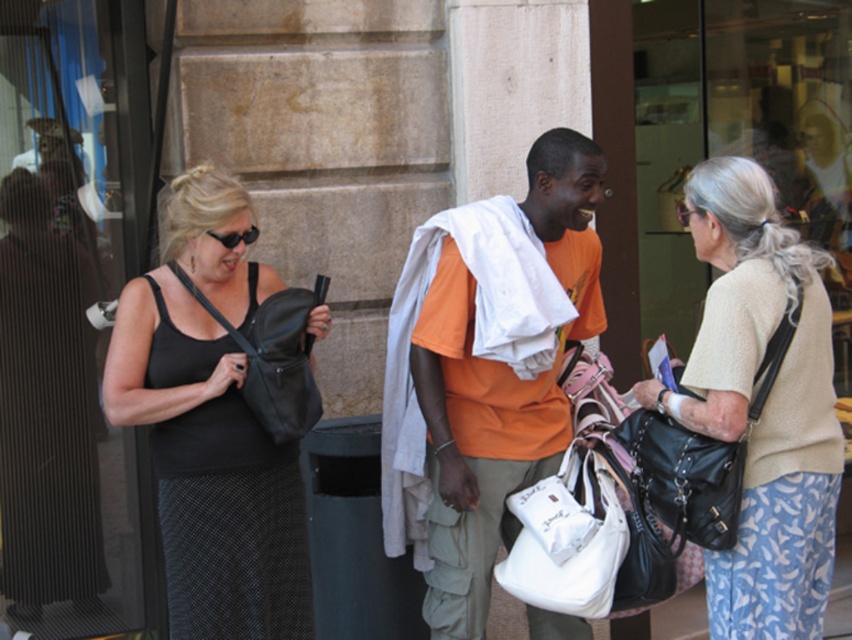
Which is above, black leather bag at center or black plastic sunglasses at upper left?

black plastic sunglasses at upper left is higher up.

Identify the location of black leather bag at center. (275, 356).

From the picture: Measure the distance between point (289,406) and camera.

Point (289,406) is 3.28 meters away from camera.

At what (x,y) coordinates should I click in order to perform the action: click on black leather bag at center. Please return your answer as a coordinate pair (x, y). The image size is (852, 640). Looking at the image, I should click on click(x=275, y=356).

Identify the location of black leather handbag at right. (701, 456).

Is black leather handbag at right positioned at the back of black leather bag at center?

No, it is in front of black leather bag at center.

Consider the image. Who is more distant from viewer, [694,504] or [281,419]?

The point [281,419] is behind.

Identify the location of black leather handbag at right. Image resolution: width=852 pixels, height=640 pixels. (701, 456).

Between orange cotton shirt at center and black leather handbag at right, which one has more height?

With more height is orange cotton shirt at center.

Is the position of orange cotton shirt at center less distant than that of black leather handbag at right?

No.

Which is behind, point (435, 369) or point (720, 515)?

The point (435, 369) is behind.

The width and height of the screenshot is (852, 640). I want to click on orange cotton shirt at center, so click(x=469, y=428).